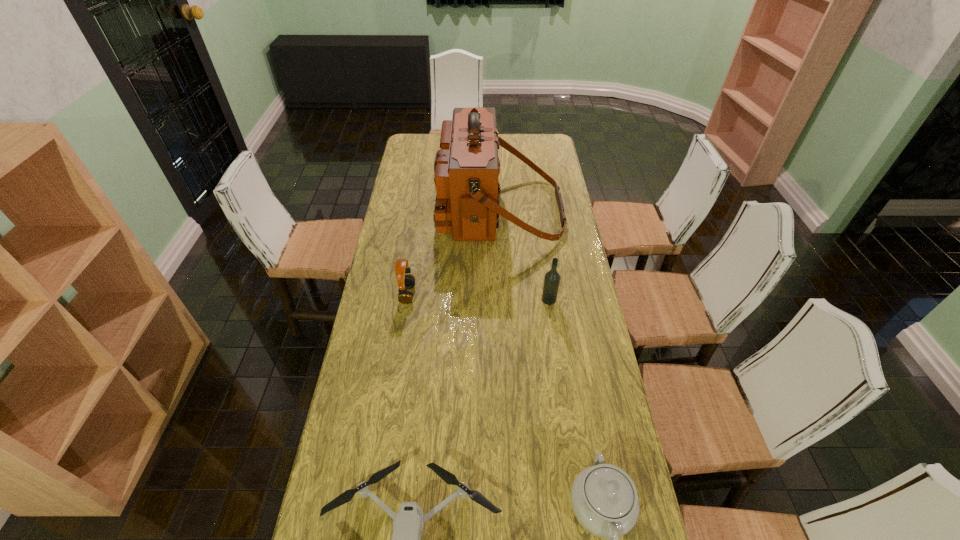
Image resolution: width=960 pixels, height=540 pixels. What are the coordinates of `the farthest object` in the screenshot? It's located at (466, 169).

Where is `the tallest object`? Image resolution: width=960 pixels, height=540 pixels. the tallest object is located at coordinates (466, 169).

Locate an element on the screen. The image size is (960, 540). vodka is located at coordinates (552, 278).

Identify the location of headset. The width and height of the screenshot is (960, 540). (404, 281).

The height and width of the screenshot is (540, 960). In order to click on vacant space located 0.120m on the face side of the farthest object in this screenshot , I will do `click(410, 210)`.

Locate an element on the screen. This screenshot has width=960, height=540. vacant area situated 0.090m on the right of the second tallest object is located at coordinates (582, 299).

The height and width of the screenshot is (540, 960). I want to click on vacant point located on the ear cups of the headset, so click(x=523, y=294).

The height and width of the screenshot is (540, 960). In order to click on object located in the left edge section of the desktop in this screenshot , I will do `click(404, 281)`.

Locate an element on the screen. The height and width of the screenshot is (540, 960). satchel that is at the right edge is located at coordinates (466, 169).

The image size is (960, 540). What are the coordinates of `vodka located at the right edge` in the screenshot? It's located at (552, 278).